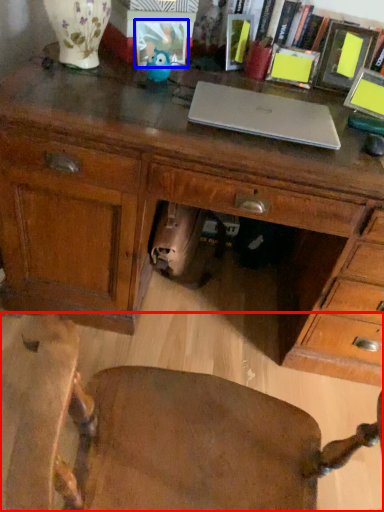
Question: Which object is closer to the camera taking this photo, chair (highlighted by a red box) or picture frame (highlighted by a blue box)?

Choices:
 (A) chair
 (B) picture frame

Answer: (A)